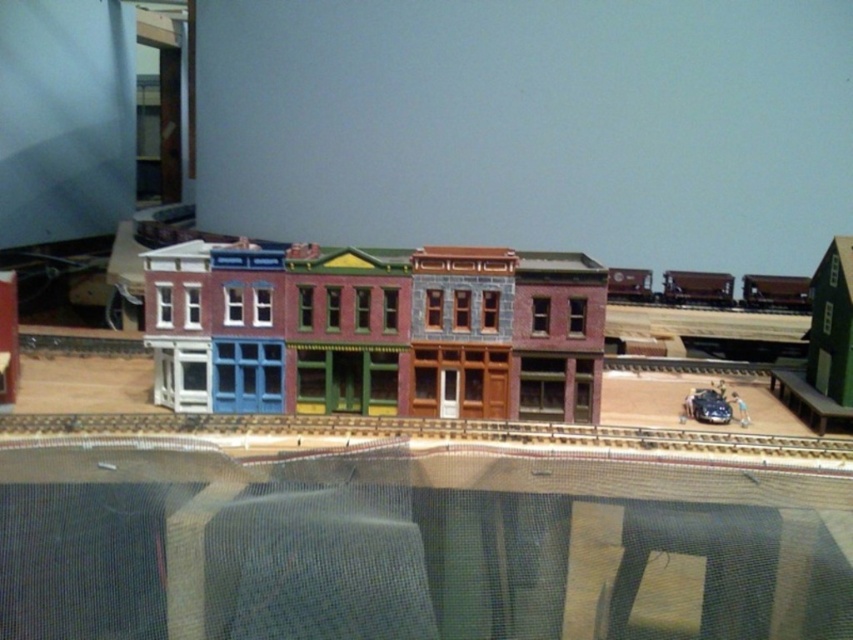
You are a toy train operator who needs to navigate your train along the metallic silver train track at center. The multicolored painted building at center is in the way. Is there enough vertical clearance for the train to pass underneath the building?

The multicolored painted building at center is located above the metallic silver train track at center, so there is sufficient vertical clearance for the train to pass underneath the building without any issues.

You are a model train engineer who wants to place a new train car that is 5 inches long on the metallic silver train track at center. The multicolored painted building at center is in the way. Can you fit the train car on the track without hitting the building?

The multicolored painted building at center and metallic silver train track at center are 4.79 inches apart from each other. Since the train car is 5 inches long, it would extend beyond the space between them, so the train car cannot fit without hitting the building.

You are a model train enthusiast who wants to place a new toy car that is 10 cm long in the scene. Given the multicolored painted building at center and the shiny silver train car at center, which object can the toy car fit in front of without overlapping?

The toy car can fit in front of the shiny silver train car at center because it is smaller than the multicolored painted building at center, so there is enough space in front of it for the car.